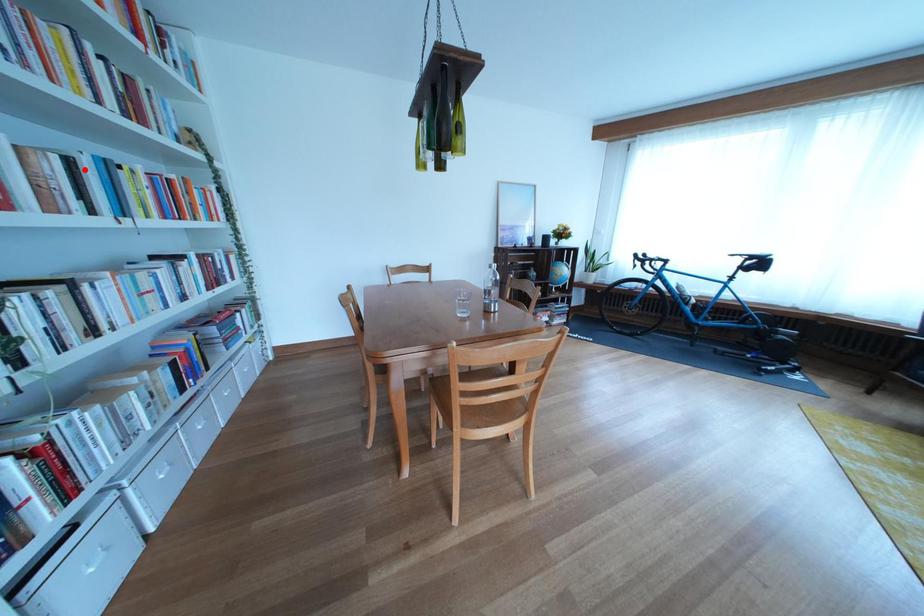
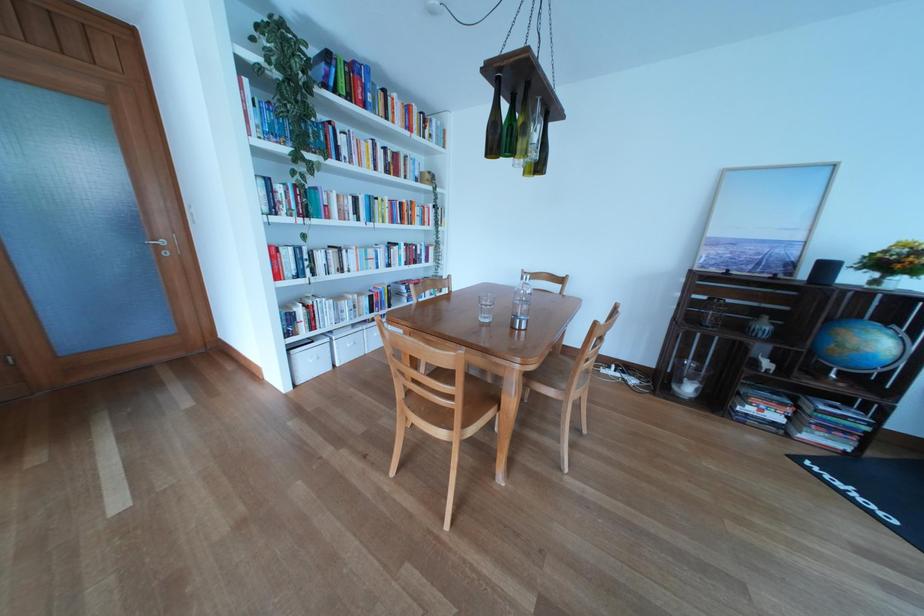
Where in the second image is the point corresponding to the highlighted location from the first image?

(369, 206)